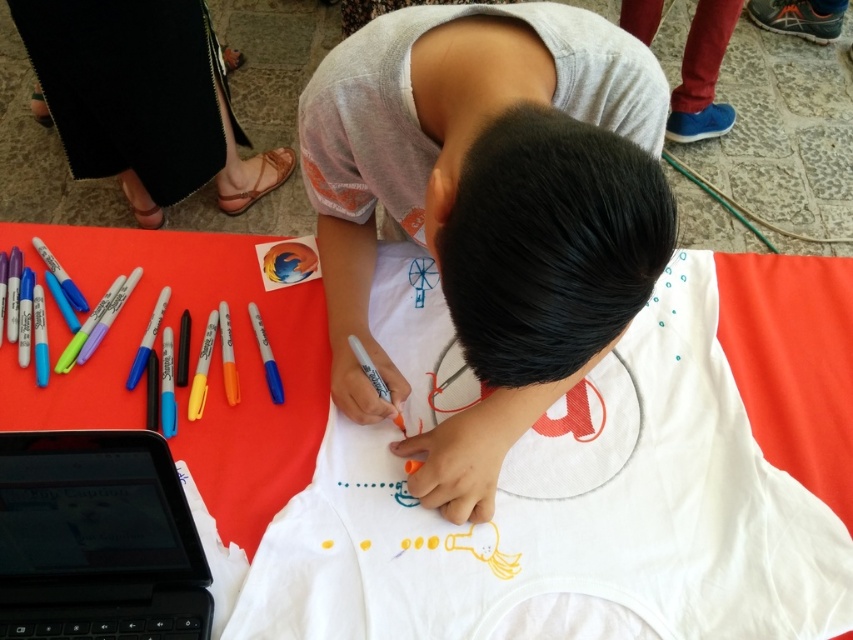
Can you confirm if white fabric at center is positioned to the right of white matte shirt at center?

Indeed, white fabric at center is positioned on the right side of white matte shirt at center.

Who is taller, white fabric at center or white matte shirt at center?

Standing taller between the two is white matte shirt at center.

Does point (683, 314) lie in front of point (648, 67)?

No, it is behind (648, 67).

Find the location of a particular element. white fabric at center is located at coordinates (572, 513).

Is white matte shirt at center above black plastic laptop at lower left?

Yes, white matte shirt at center is above black plastic laptop at lower left.

This screenshot has width=853, height=640. Identify the location of white matte shirt at center. (488, 209).

Is white matte shirt at center positioned at the back of black shiny hair at center?

Yes, it is.

Is white matte shirt at center taller than black shiny hair at center?

Yes, white matte shirt at center is taller than black shiny hair at center.

Is point (535, 387) positioned behind point (521, 228)?

Yes, point (535, 387) is farther from viewer.

Where is `white matte shirt at center`? white matte shirt at center is located at coordinates (488, 209).